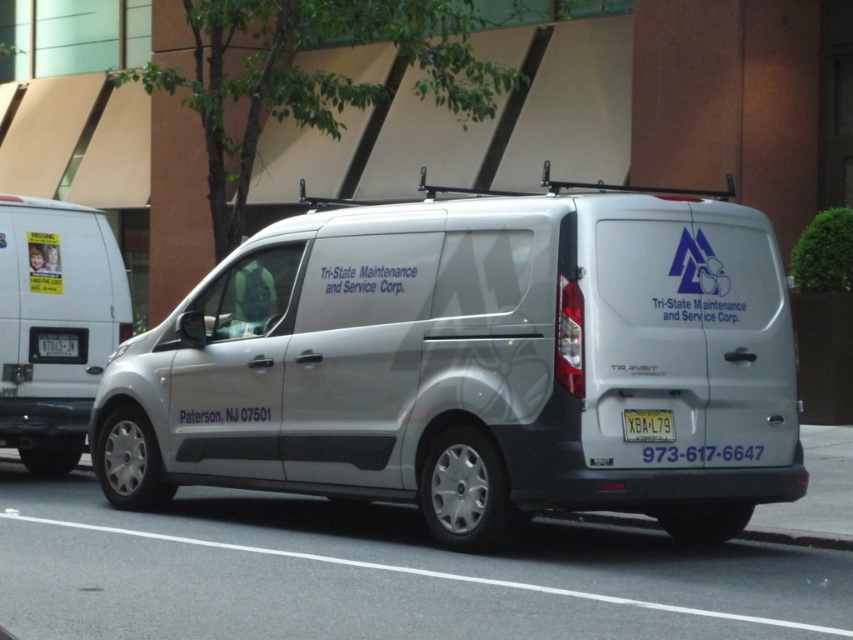
What is located at the coordinates point (474, 364)?

The silver metallic van at center is located at point (474, 364).